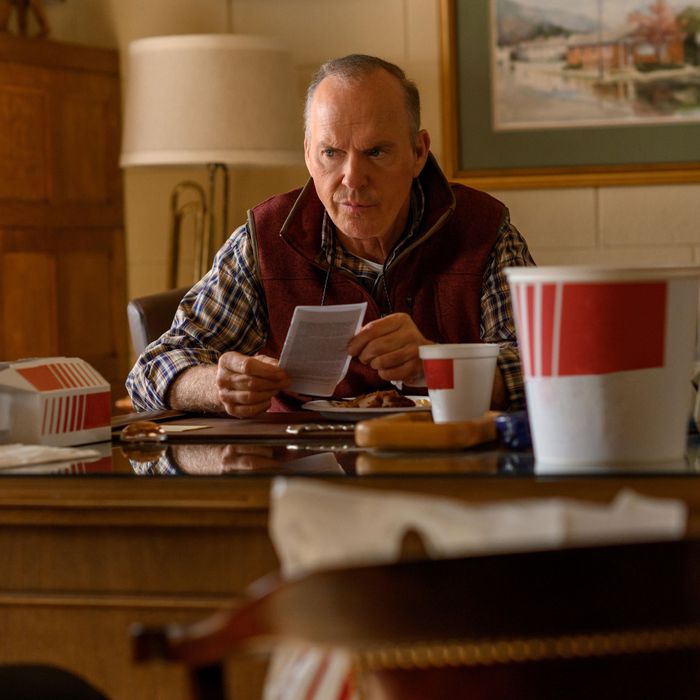
Find the location of a particular element. Image resolution: width=700 pixels, height=700 pixels. the second coffee cup, to left rear of cup on right side is located at coordinates (456, 388), (465, 370).